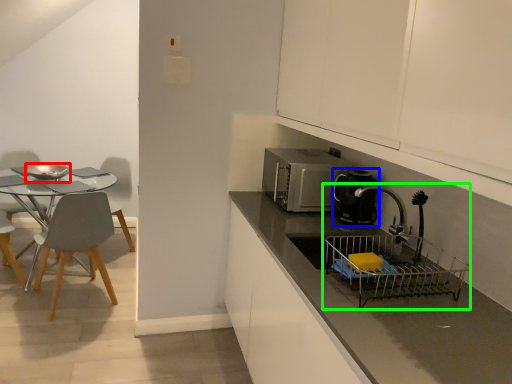
Question: Which object is positioned farthest from appliance (highlighted by a red box)? Select from kitchen appliance (highlighted by a blue box) and sink (highlighted by a green box).

Choices:
 (A) kitchen appliance
 (B) sink

Answer: (B)